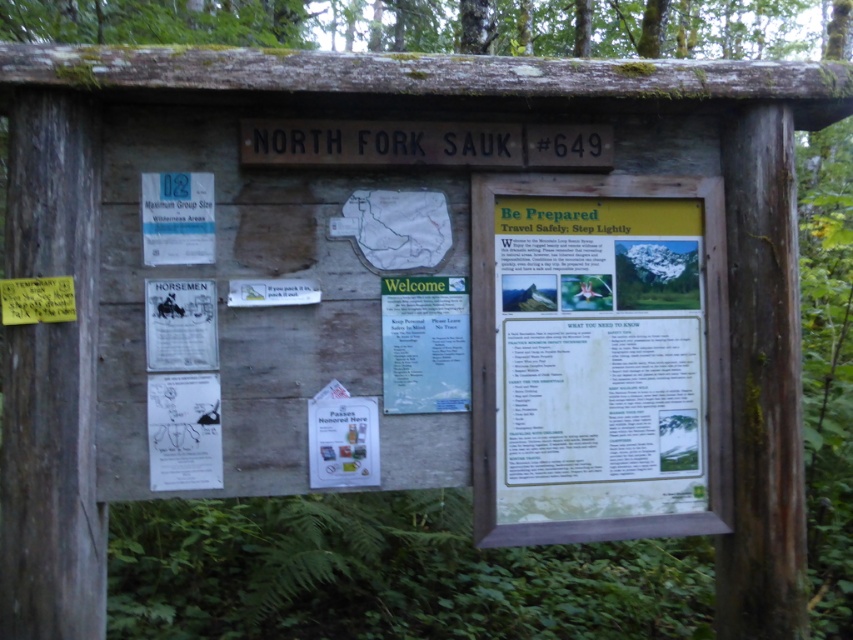
You are a hiker who just arrived at the wooden signboard in the forest. You need to read both the matte yellow poster at center right and the white paper poster at left. Which poster should you look at first to ensure you can see both without moving your position?

You should look at the matte yellow poster at center right first because it is closer to you than the white paper poster at left, so you can see it without moving, and then you can glance at the white paper poster at left which is behind it.